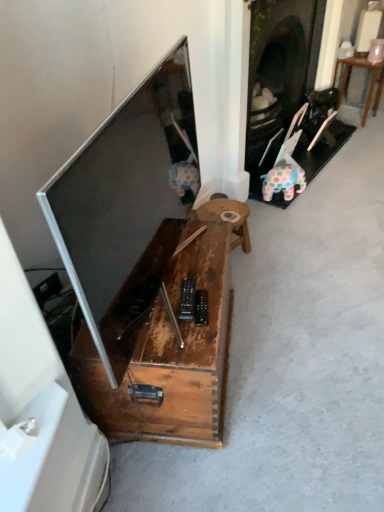
Question: Is rustic wood table at center, the 1th table when ordered from front to back, shorter than rustic wood coffee table at center?

Choices:
 (A) no
 (B) yes

Answer: (B)

Question: Would you consider rustic wood table at center, which is counted as the second table, starting from the right, to be distant from rustic wood coffee table at center?

Choices:
 (A) yes
 (B) no

Answer: (B)

Question: Does rustic wood table at center, which is the second table from back to front, have a larger size compared to rustic wood coffee table at center?

Choices:
 (A) no
 (B) yes

Answer: (A)

Question: From the image's perspective, is rustic wood table at center, which appears as the first table when viewed from the left, located beneath rustic wood coffee table at center?

Choices:
 (A) yes
 (B) no

Answer: (B)

Question: Considering the relative positions of rustic wood table at center, the 1th table when ordered from front to back, and rustic wood coffee table at center in the image provided, is rustic wood table at center, the 1th table when ordered from front to back, to the right of rustic wood coffee table at center from the viewer's perspective?

Choices:
 (A) no
 (B) yes

Answer: (B)

Question: Is wooden table at right, which is the second table in bottom-to-top order, wider or thinner than rustic wood coffee table at center?

Choices:
 (A) wide
 (B) thin

Answer: (B)

Question: From a real-world perspective, is wooden table at right, the second table viewed from the left, positioned above or below rustic wood coffee table at center?

Choices:
 (A) above
 (B) below

Answer: (B)

Question: Does point (342, 62) appear closer or farther from the camera than point (148, 415)?

Choices:
 (A) closer
 (B) farther

Answer: (B)

Question: Based on their positions, is wooden table at right, the first table in the back-to-front sequence, located to the left or right of rustic wood coffee table at center?

Choices:
 (A) right
 (B) left

Answer: (A)

Question: Is point (132, 347) positioned closer to the camera than point (150, 137)?

Choices:
 (A) farther
 (B) closer

Answer: (A)

Question: Would you say rustic wood coffee table at center is to the left or to the right of matte black tv at left in the picture?

Choices:
 (A) right
 (B) left

Answer: (B)

Question: Do you think rustic wood coffee table at center is within matte black tv at left, or outside of it?

Choices:
 (A) inside
 (B) outside

Answer: (B)

Question: In terms of height, does rustic wood coffee table at center look taller or shorter compared to matte black tv at left?

Choices:
 (A) tall
 (B) short

Answer: (B)

Question: In terms of height, does wooden table at right, which is the second table in bottom-to-top order, look taller or shorter compared to rustic wood table at center, the 1th table when ordered from front to back?

Choices:
 (A) tall
 (B) short

Answer: (A)

Question: From a real-world perspective, is wooden table at right, the second table viewed from the left, above or below rustic wood table at center, the 2th table in the top-to-bottom sequence?

Choices:
 (A) above
 (B) below

Answer: (A)